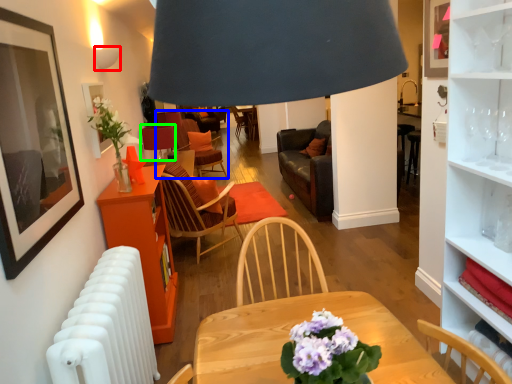
Question: Which object is the farthest from lamp (highlighted by a red box)? Choose among these: chair (highlighted by a blue box) or table lamp (highlighted by a green box).

Choices:
 (A) chair
 (B) table lamp

Answer: (A)